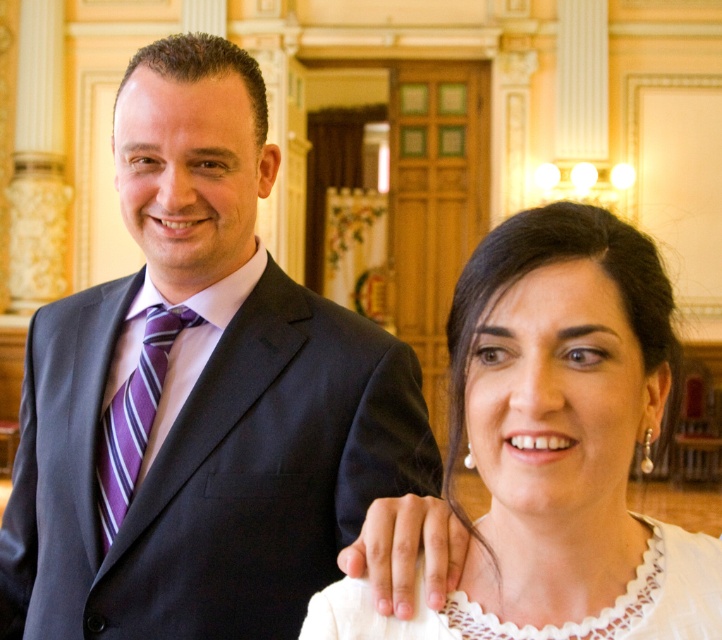
You are a photographer setting up for a group photo and need to ensure that both the white lace blouse at center and the purple striped tie at left are visible in the frame. Based on their positions, which one is closer to the camera?

The white lace blouse at center is in front of the purple striped tie at left, so it is closer to the camera.

You are organizing a photo shoot and need to arrange the matte black suit at center and the white lace dress at center in a way that they are aligned symmetrically. Given their current positions, which one needs to be moved to the right to achieve symmetry?

The matte black suit at center needs to be moved to the right to align symmetrically with the white lace dress at center since it is currently on the left side of the dress.

Where is the matte black suit at center located in terms of coordinates?

The matte black suit at center is located at coordinates point [199,396].